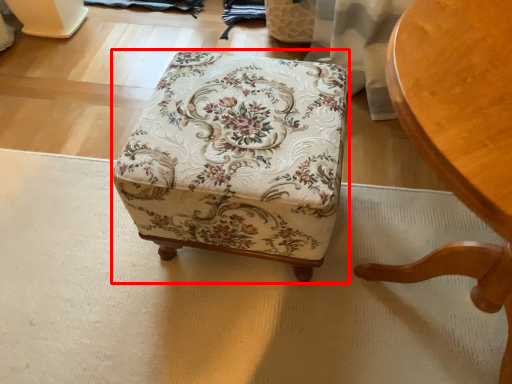
Question: From the image's perspective, what is the correct spatial relationship of furniture (annotated by the red box) in relation to chair?

Choices:
 (A) above
 (B) below

Answer: (A)